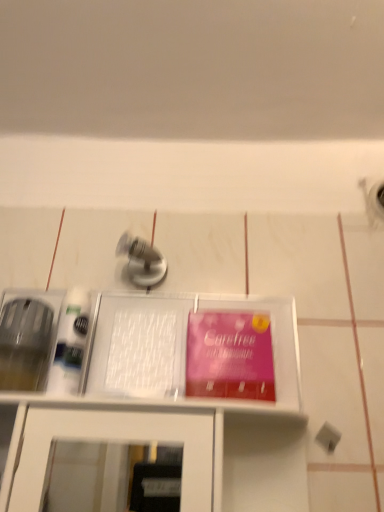
Question: Is satin nickel faucet at center bigger or smaller than white plastic tray at center?

Choices:
 (A) small
 (B) big

Answer: (A)

Question: Is satin nickel faucet at center in front of or behind white plastic tray at center in the image?

Choices:
 (A) behind
 (B) front

Answer: (A)

Question: Considering the real-world distances, which object is closest to the pink matte paper at center?

Choices:
 (A) white plastic tray at center
 (B) satin nickel faucet at center

Answer: (A)

Question: Estimate the real-world distances between objects in this image. Which object is closer to the satin nickel faucet at center?

Choices:
 (A) pink matte paper at center
 (B) white plastic tray at center

Answer: (A)